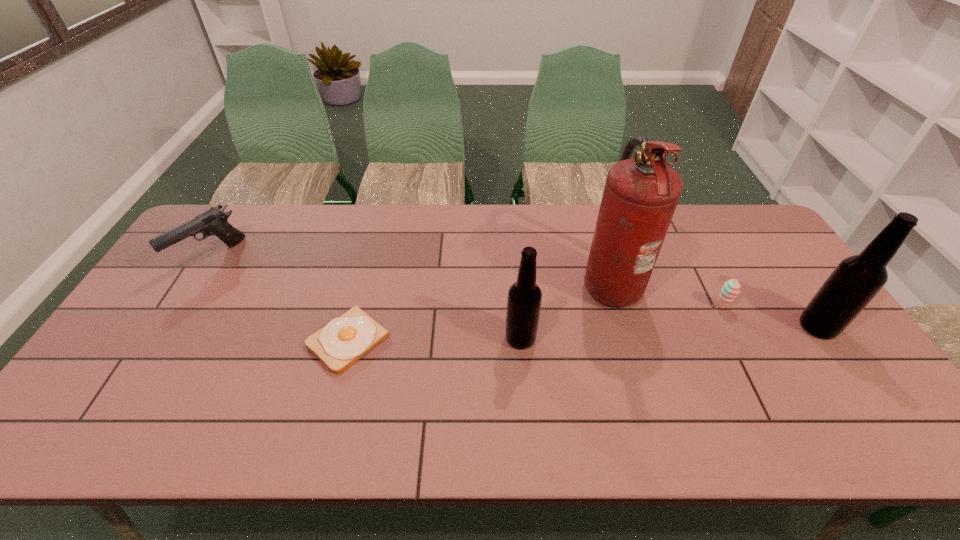
Locate an element on the screen. The image size is (960, 540). vacant spot to place a beer bottle on the left is located at coordinates (209, 350).